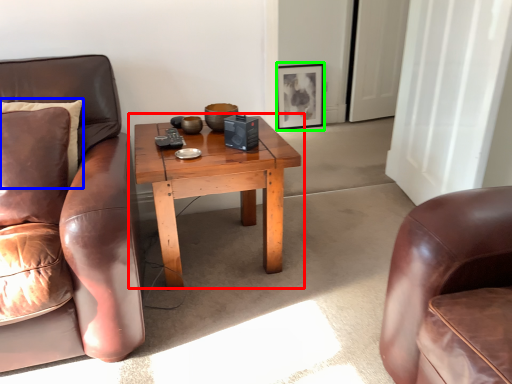
Question: Based on their relative distances, which object is farther from coffee table (highlighted by a red box)? Choose from pillow (highlighted by a blue box) and picture frame (highlighted by a green box).

Choices:
 (A) pillow
 (B) picture frame

Answer: (B)